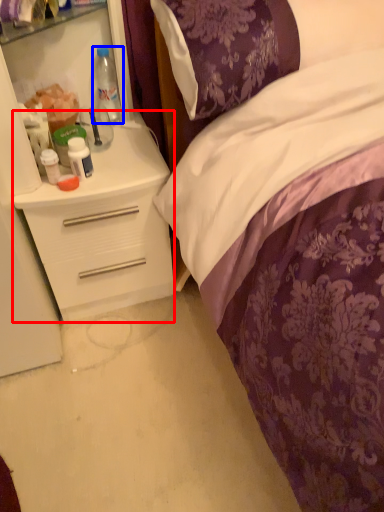
Question: Which point is further to the camera, desk (highlighted by a red box) or bottle (highlighted by a blue box)?

Choices:
 (A) desk
 (B) bottle

Answer: (B)